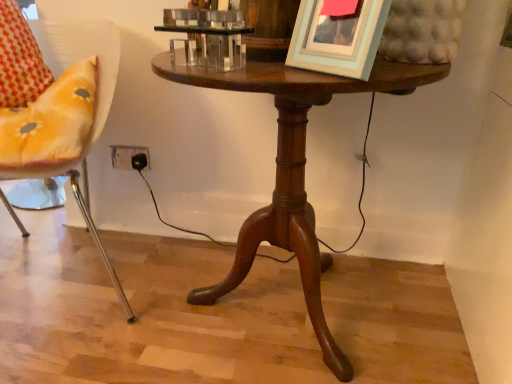
Question: Is mahogany wood table at center wider or thinner than light blue matte picture frame at upper right?

Choices:
 (A) thin
 (B) wide

Answer: (B)

Question: Relative to light blue matte picture frame at upper right, is mahogany wood table at center in front or behind?

Choices:
 (A) behind
 (B) front

Answer: (A)

Question: Estimate the real-world distances between objects in this image. Which object is closer to the light blue matte picture frame at upper right?

Choices:
 (A) metallic yellow chair at left
 (B) mahogany wood table at center

Answer: (B)

Question: Which of these objects is positioned closest to the mahogany wood table at center?

Choices:
 (A) metallic yellow chair at left
 (B) light blue matte picture frame at upper right

Answer: (B)